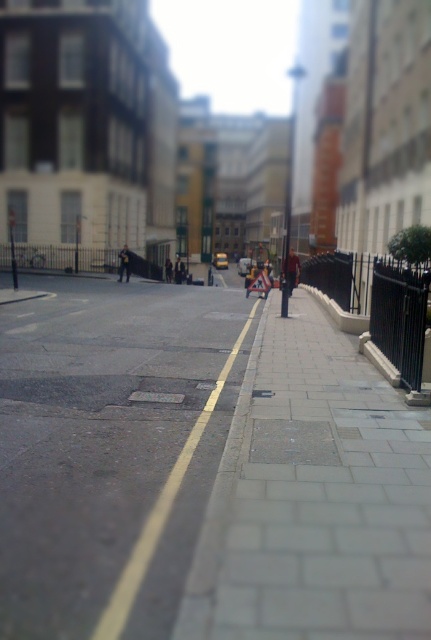
Question: Observing the image, what is the correct spatial positioning of dark gray suit at center in reference to dark brown leather jacket at center?

Choices:
 (A) above
 (B) below

Answer: (A)

Question: Is dark blue jeans at center below dark gray suit at center?

Choices:
 (A) yes
 (B) no

Answer: (A)

Question: Among these objects, which one is farthest from the camera?

Choices:
 (A) dark blue jeans at center
 (B) dark gray suit at center
 (C) paved stone sidewalk at center

Answer: (B)

Question: Which of the following is the closest to the observer?

Choices:
 (A) paved stone sidewalk at center
 (B) red jacket at center
 (C) dark blue jeans at center
 (D) dark brown leather jacket at center

Answer: (A)

Question: Can you confirm if paved stone sidewalk at center is positioned to the left of dark brown leather jacket at center?

Choices:
 (A) yes
 (B) no

Answer: (B)

Question: Which of the following is the farthest from the observer?

Choices:
 (A) red jacket at center
 (B) paved stone sidewalk at center

Answer: (A)